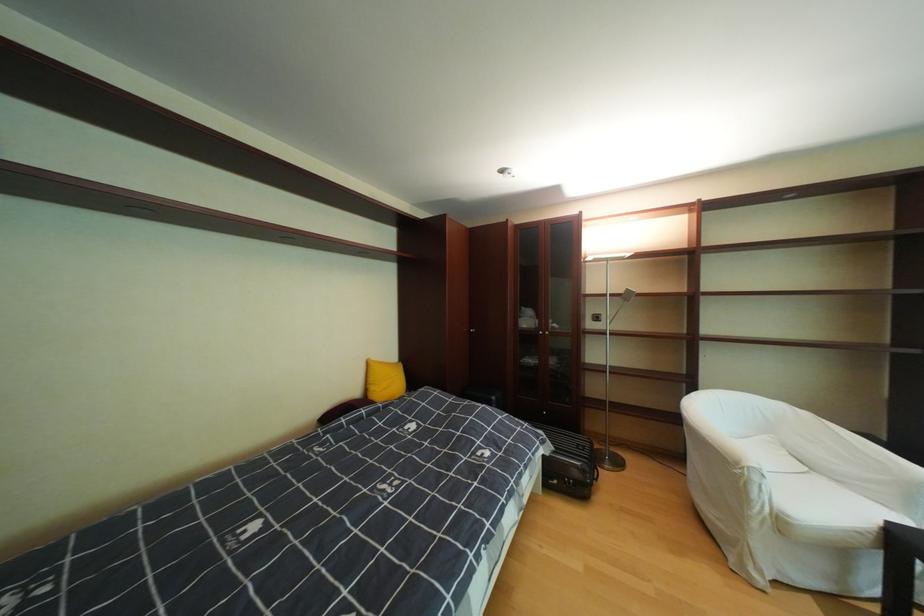
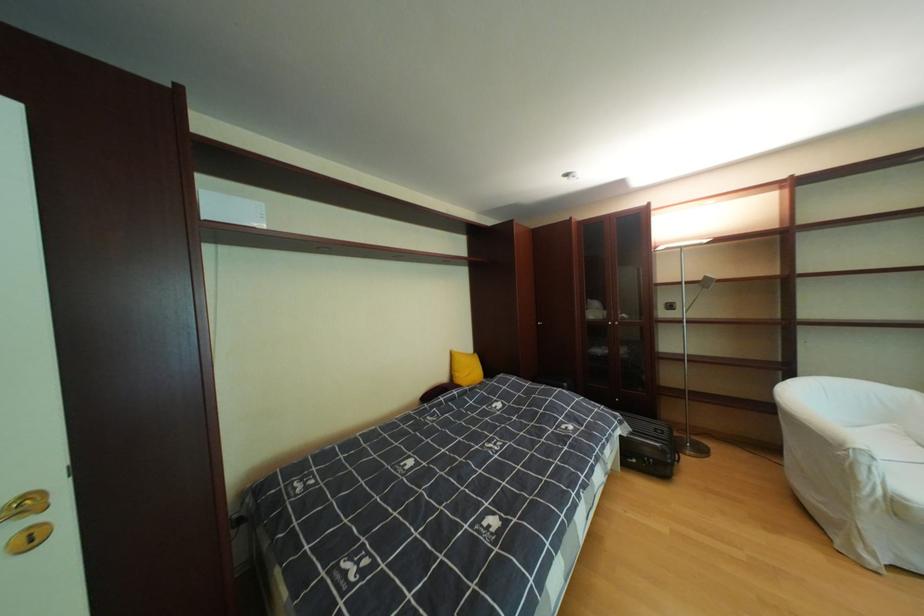
The point at (793, 523) is marked in the first image. Where is the corresponding point in the second image?

(908, 506)